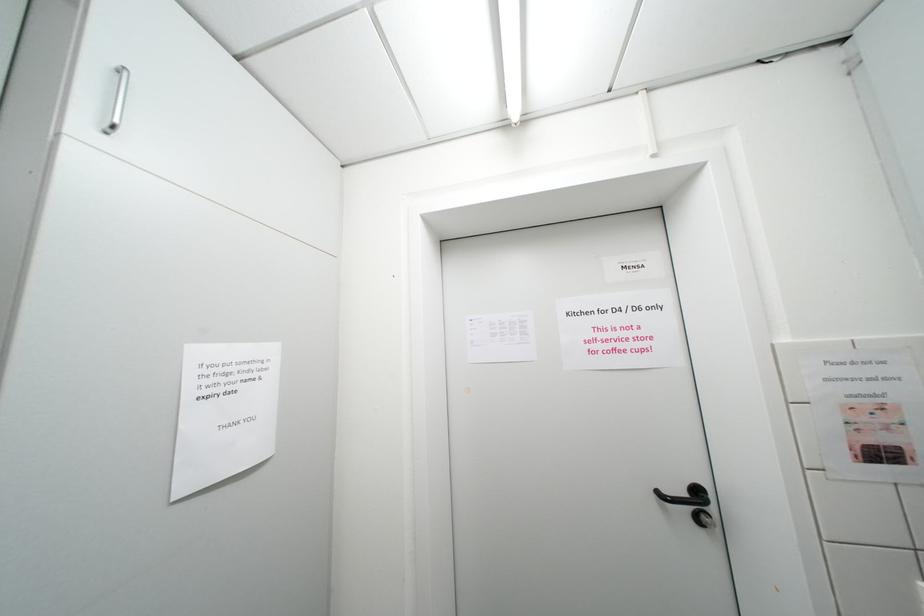
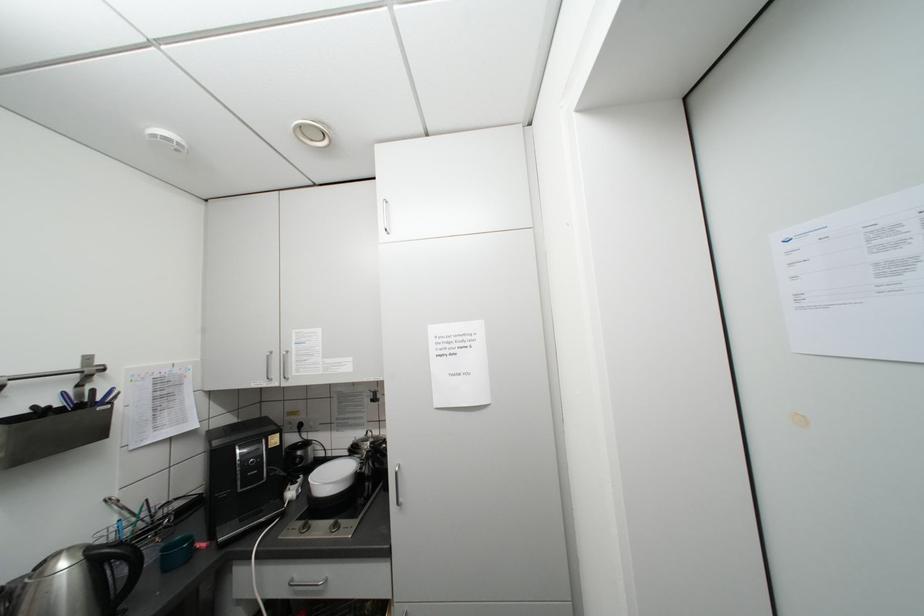
Question: The camera is either moving clockwise (left) or counter-clockwise (right) around the object. The first image is from the beginning of the video and the second image is from the end. Is the camera moving left or right when shooting the video?

Choices:
 (A) Left
 (B) Right

Answer: (B)